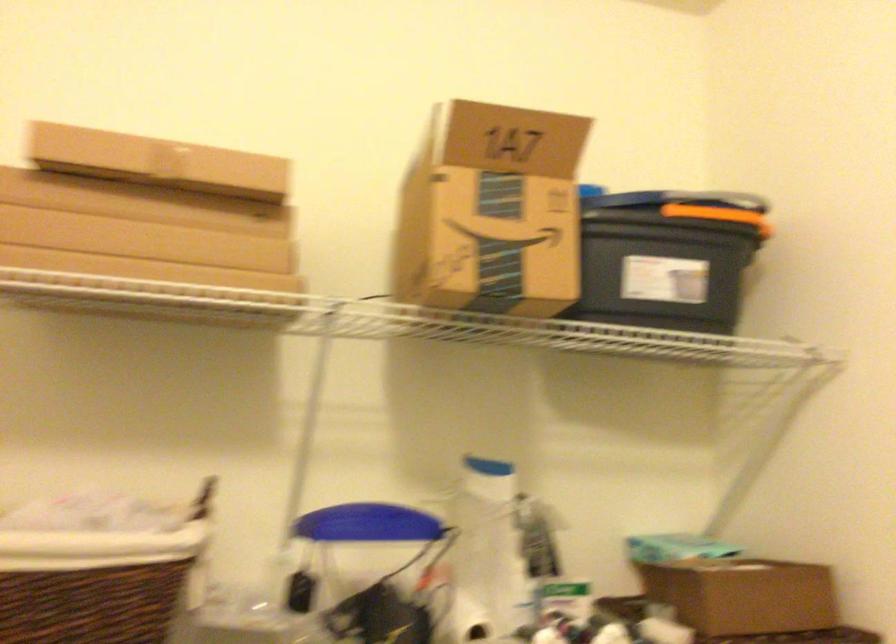
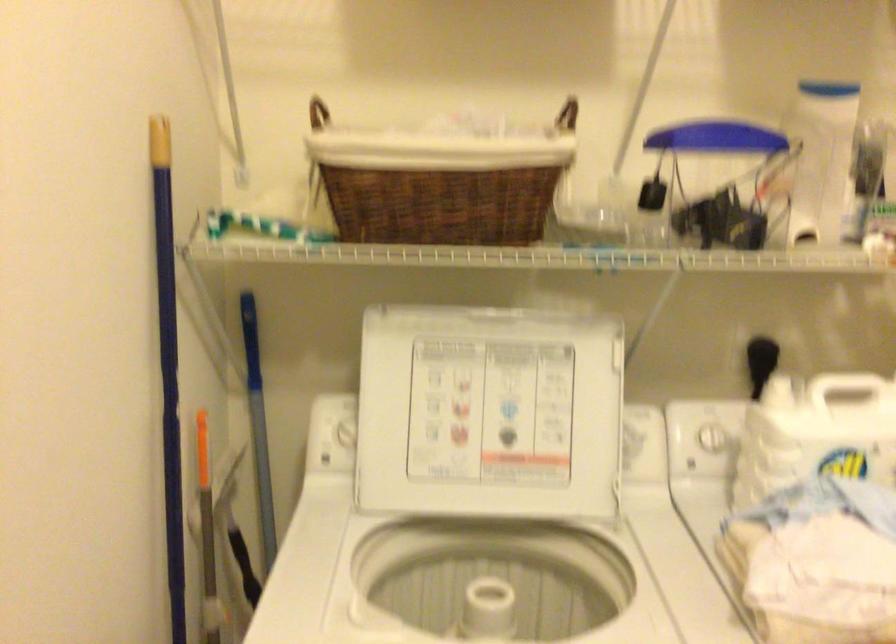
Locate, in the second image, the point that corresponds to (485,545) in the first image.

(821, 158)